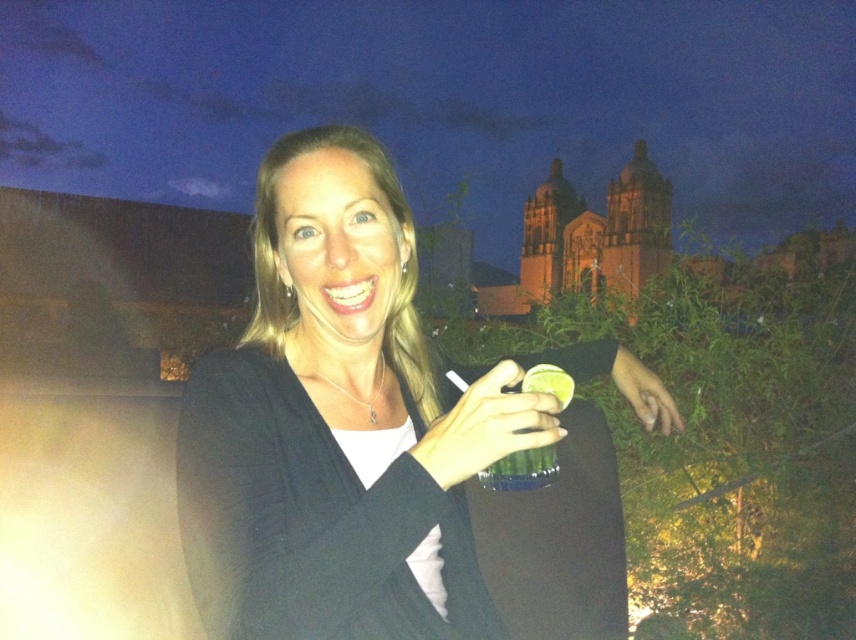
You are a photographer adjusting the lighting for a portrait. You notice the matte black dress at center and the matte plastic cup at center in the scene. Which object is closer to the left side of the frame?

The matte black dress at center is positioned on the left side of the matte plastic cup at center, so it is closer to the left side of the frame.

You are a photographer adjusting the focus on your camera. You notice the matte black dress at center and the matte plastic cup at center. Which object should you focus on if you want to capture the larger one clearly?

The matte black dress at center is bigger than the matte plastic cup at center, so you should focus on the matte black dress at center to capture the larger one clearly.

You are a photographer standing at the scene and want to capture a closeup of the matte black dress at center. Considering your current position, do you think you can get a clear closeup without moving closer?

The matte black dress at center is 65.59 meters from viewer, so no, you cannot get a clear closeup without moving closer because the distance is too far.